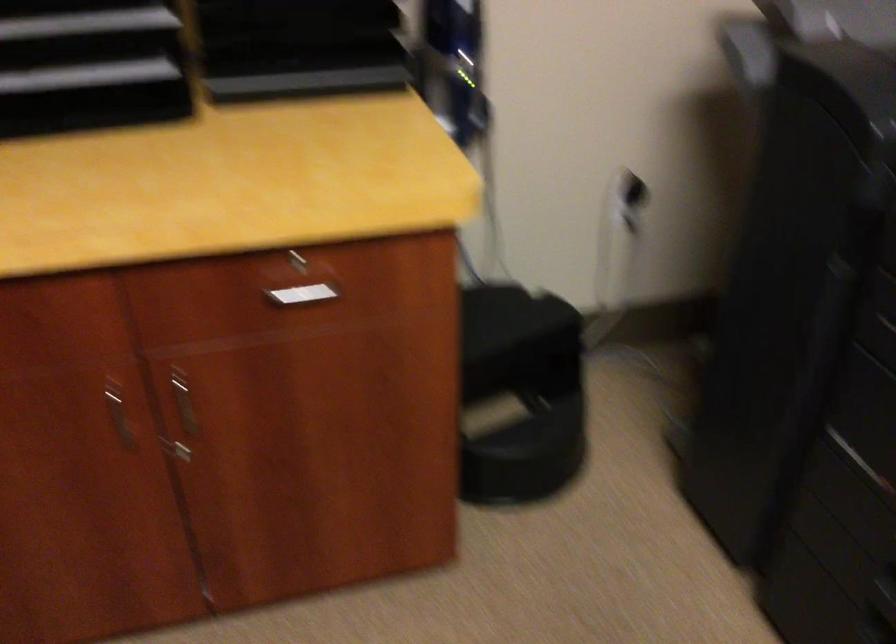
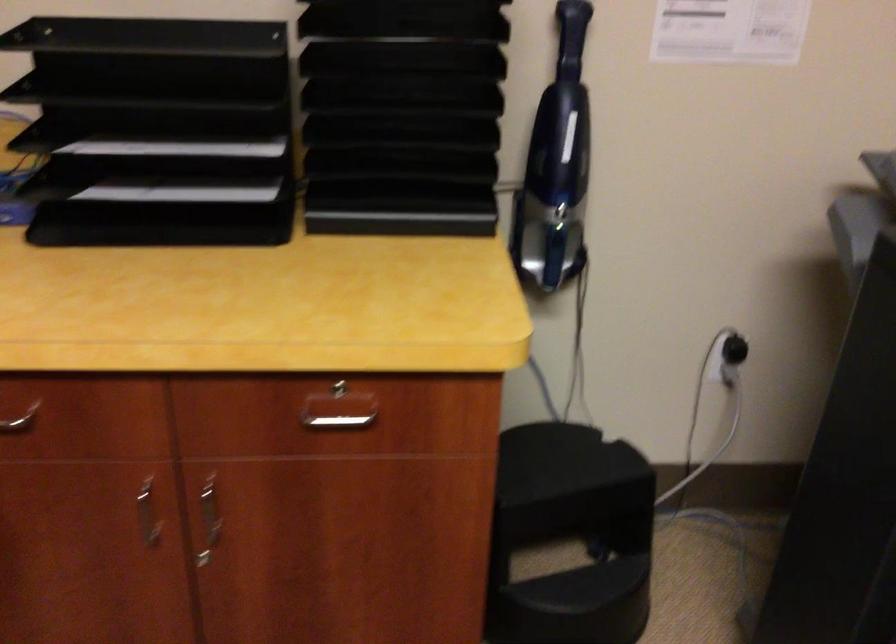
Question: I am providing you with two images of the same scene from different viewpoints. After the viewpoint changes to image2, which objects are now occluded?

Choices:
 (A) black electrical plug
 (B) silver drawer handle
 (C) drawer keyhole
 (D) none of these

Answer: (D)